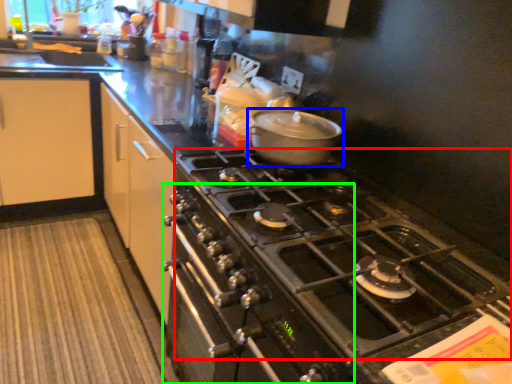
Question: Estimate the real-world distances between objects in this image. Which object is closer to gas stove (highlighted by a red box), kitchen appliance (highlighted by a blue box) or oven (highlighted by a green box)?

Choices:
 (A) kitchen appliance
 (B) oven

Answer: (B)